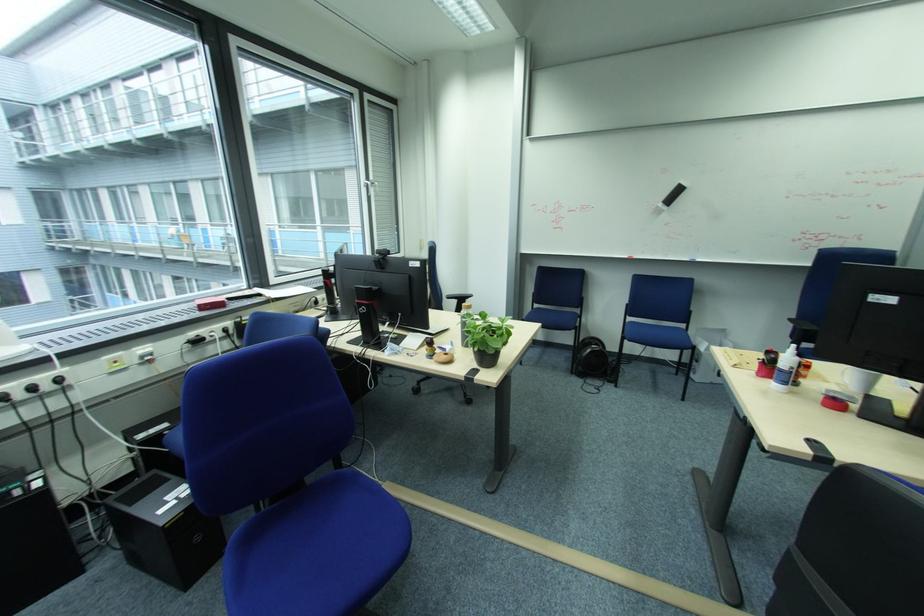
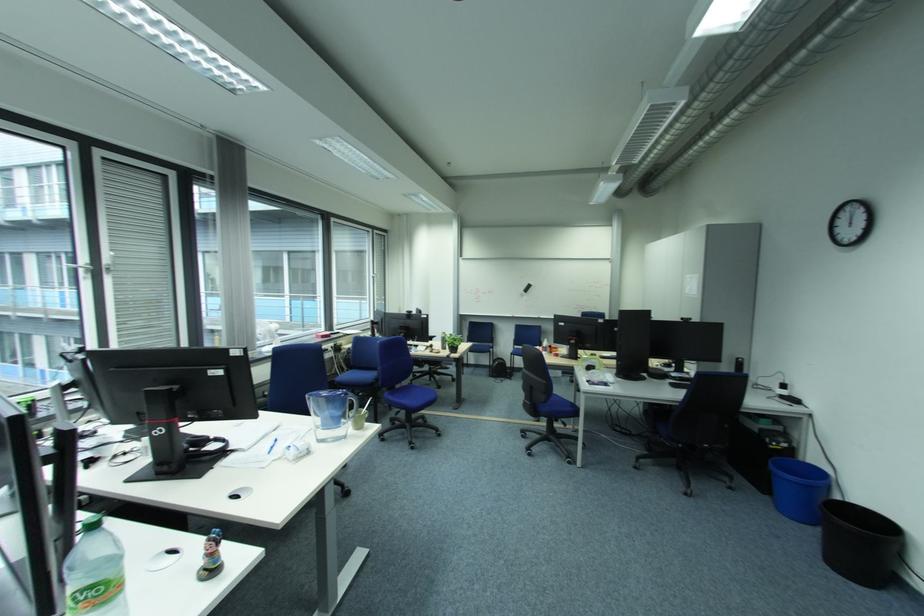
Question: What movement of the cameraman would produce the second image?

Choices:
 (A) Left
 (B) Right
 (C) Forward
 (D) Backward

Answer: (D)